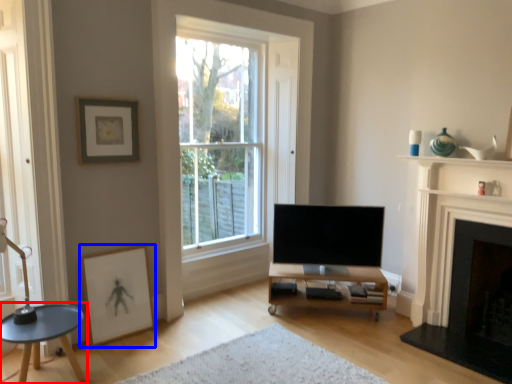
Question: Which object is closer to the camera taking this photo, coffee table (highlighted by a red box) or picture frame (highlighted by a blue box)?

Choices:
 (A) coffee table
 (B) picture frame

Answer: (A)